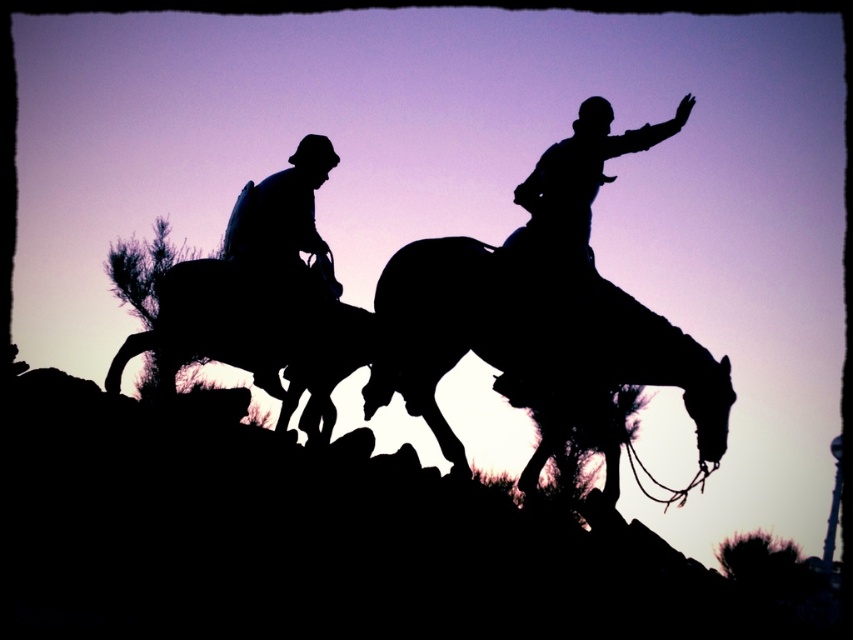
Question: Can you confirm if silhouette horse at center is positioned above silhouette hat at left?

Choices:
 (A) yes
 (B) no

Answer: (B)

Question: Does silhouette horse at center have a lesser width compared to silhouette horse at left?

Choices:
 (A) no
 (B) yes

Answer: (B)

Question: Which of the following is the closest to the observer?

Choices:
 (A) (241, 196)
 (B) (250, 362)
 (C) (373, 371)

Answer: (B)

Question: Is silhouette horse at left smaller than silhouette hat at left?

Choices:
 (A) yes
 (B) no

Answer: (B)

Question: Which point is closer to the camera?

Choices:
 (A) silhouette hat at left
 (B) silhouette horse at center
 (C) silhouette horse at left

Answer: (B)

Question: Which of the following is the farthest from the observer?

Choices:
 (A) silhouette hat at left
 (B) silhouette horse at left
 (C) silhouette horse at center

Answer: (A)